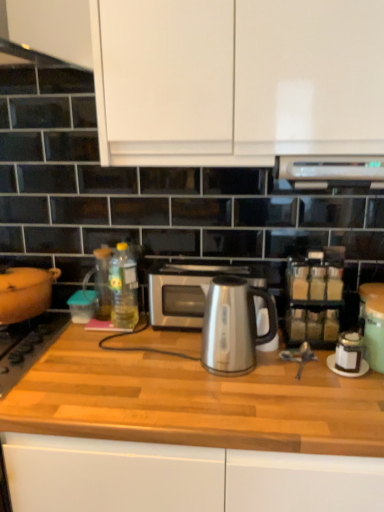
Question: Considering the relative sizes of white matte cabinet at upper center and satin silver microwave at center in the image provided, is white matte cabinet at upper center thinner than satin silver microwave at center?

Choices:
 (A) yes
 (B) no

Answer: (B)

Question: Is white matte cabinet at upper center behind satin silver microwave at center?

Choices:
 (A) yes
 (B) no

Answer: (B)

Question: Is white matte cabinet at upper center not inside satin silver microwave at center?

Choices:
 (A) yes
 (B) no

Answer: (A)

Question: Does white matte cabinet at upper center come in front of satin silver microwave at center?

Choices:
 (A) no
 (B) yes

Answer: (B)

Question: From a real-world perspective, does white matte cabinet at upper center sit lower than satin silver microwave at center?

Choices:
 (A) no
 (B) yes

Answer: (A)

Question: Based on their sizes in the image, would you say matte orange pot at left is bigger or smaller than black glass gas stove at left?

Choices:
 (A) big
 (B) small

Answer: (B)

Question: Considering the positions of matte orange pot at left and black glass gas stove at left in the image, is matte orange pot at left wider or thinner than black glass gas stove at left?

Choices:
 (A) thin
 (B) wide

Answer: (A)

Question: From the image's perspective, is matte orange pot at left above or below black glass gas stove at left?

Choices:
 (A) above
 (B) below

Answer: (A)

Question: Considering the positions of point (36, 294) and point (26, 335), is point (36, 294) closer or farther from the camera than point (26, 335)?

Choices:
 (A) farther
 (B) closer

Answer: (A)

Question: From the image's perspective, is white matte cabinet at upper center positioned above or below matte orange pot at left?

Choices:
 (A) below
 (B) above

Answer: (B)

Question: From a real-world perspective, relative to matte orange pot at left, is white matte cabinet at upper center vertically above or below?

Choices:
 (A) below
 (B) above

Answer: (B)

Question: In terms of width, does white matte cabinet at upper center look wider or thinner when compared to matte orange pot at left?

Choices:
 (A) thin
 (B) wide

Answer: (B)

Question: Based on their sizes in the image, would you say white matte cabinet at upper center is bigger or smaller than matte orange pot at left?

Choices:
 (A) small
 (B) big

Answer: (B)

Question: Considering the positions of translucent glass spice rack at right and transparent glass bottle at center, which ranks as the first bottle in left-to-right order, in the image, is translucent glass spice rack at right bigger or smaller than transparent glass bottle at center, which ranks as the first bottle in left-to-right order,?

Choices:
 (A) small
 (B) big

Answer: (B)

Question: Is translucent glass spice rack at right taller or shorter than transparent glass bottle at center, which ranks as the first bottle in left-to-right order?

Choices:
 (A) tall
 (B) short

Answer: (A)